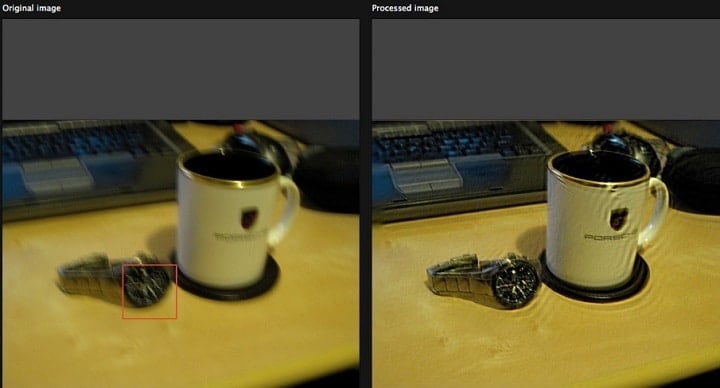
Where is `handle of white mug`? Image resolution: width=720 pixels, height=388 pixels. handle of white mug is located at coordinates (660, 204), (294, 199).